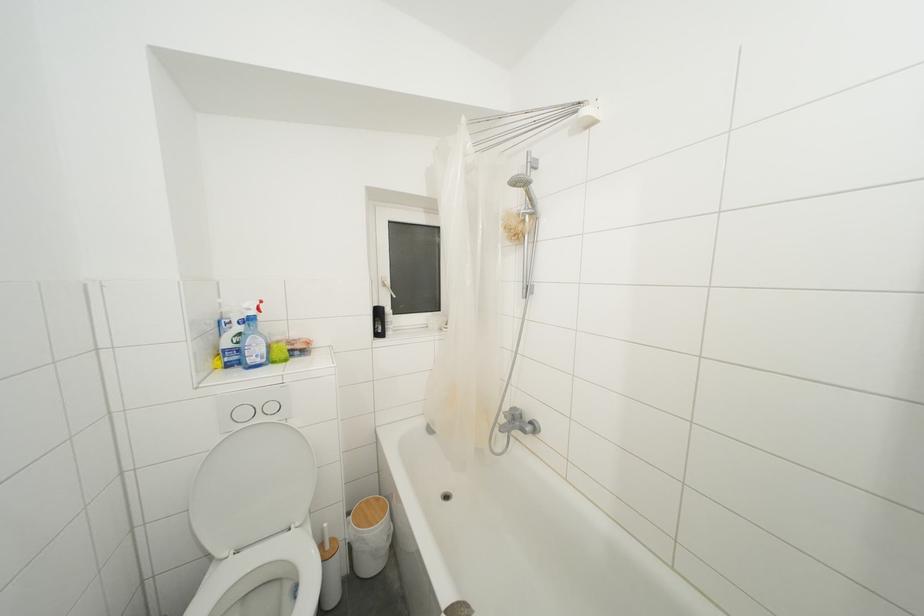
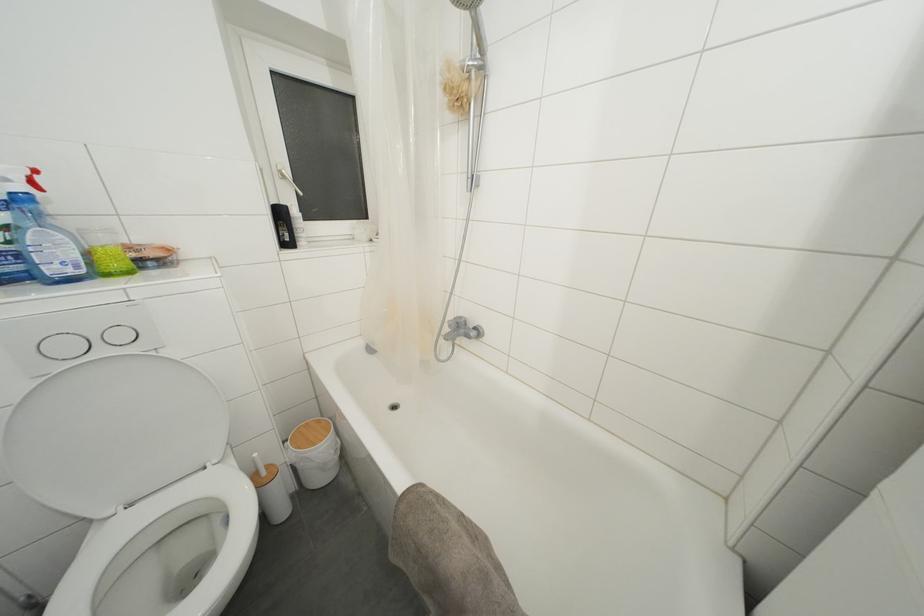
Find the pixel in the second image that matches point 511,411 in the first image.

(455, 321)